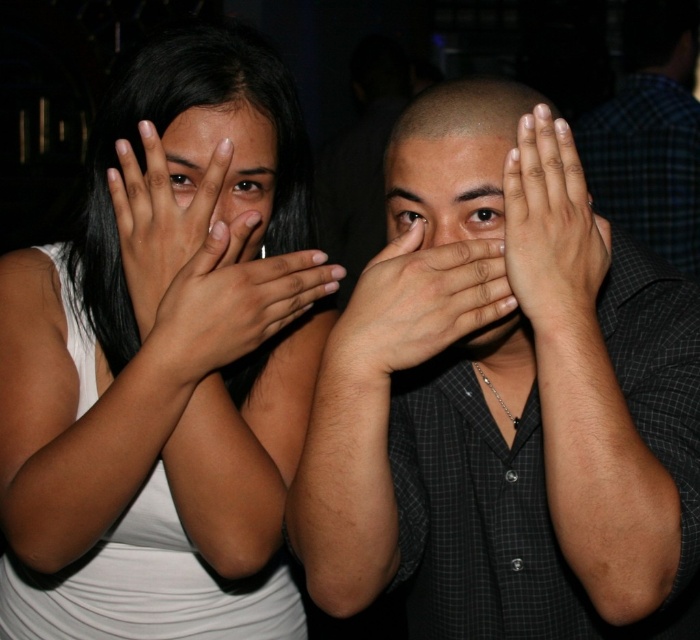
Question: Which point appears closest to the camera in this image?

Choices:
 (A) (127, 291)
 (B) (587, 193)
 (C) (252, 326)
 (D) (462, 177)

Answer: (D)

Question: Can you confirm if matte skin hands at center is smaller than dark skin tone hand at center?

Choices:
 (A) no
 (B) yes

Answer: (A)

Question: Among these points, which one is farthest from the camera?

Choices:
 (A) (519, 147)
 (B) (260, 120)
 (C) (172, 108)
 (D) (174, 145)

Answer: (B)

Question: Which object is the farthest from the black matte shirt at center?

Choices:
 (A) matte skin at center
 (B) dark skin tone hand at center
 (C) matte skin hands at center

Answer: (A)

Question: Can you confirm if matte skin hand at center is wider than matte skin at center?

Choices:
 (A) yes
 (B) no

Answer: (A)

Question: Observing the image, what is the correct spatial positioning of dark plaid shirt at right in reference to matte skin hand at center?

Choices:
 (A) above
 (B) below

Answer: (A)